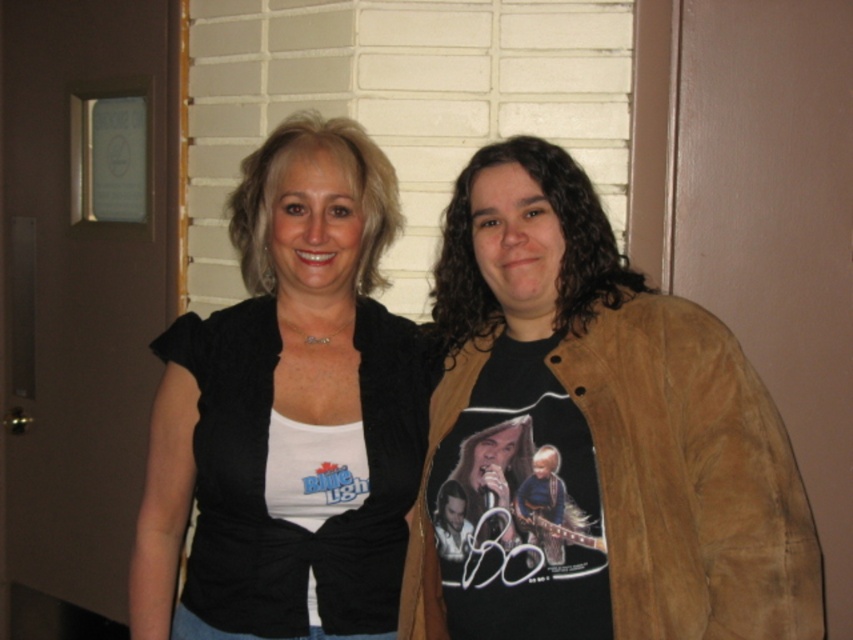
You are a photographer setting up a photo shoot in the described scene. You need to ensure that the matte black shirt at center is visible in the final image. Given that the suede jacket at right is currently blocking part of it, what adjustment should you make to the setup?

The suede jacket at right is in front of the matte black shirt at center, so to ensure visibility of the matte black shirt at center, move the suede jacket at right to a position behind or beside the matte black shirt at center.